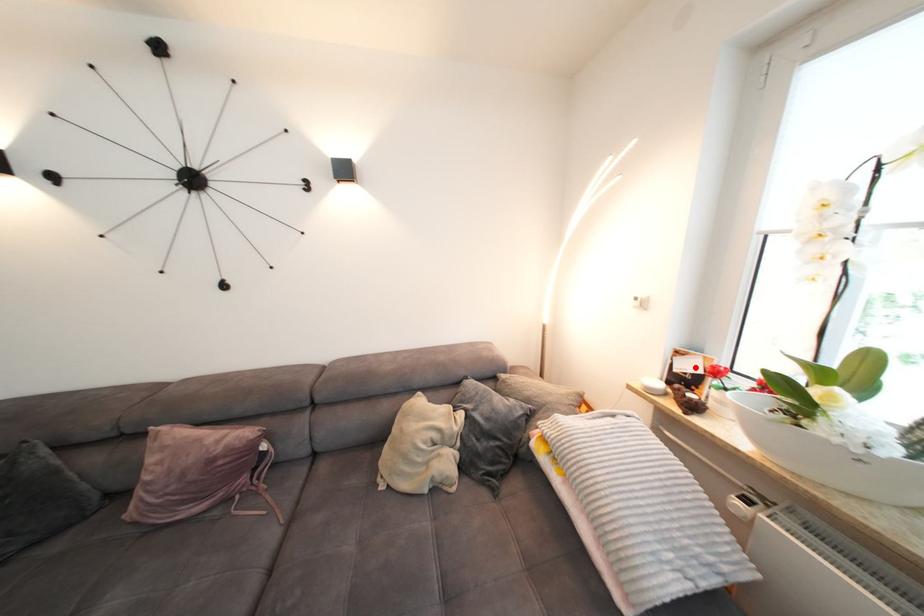
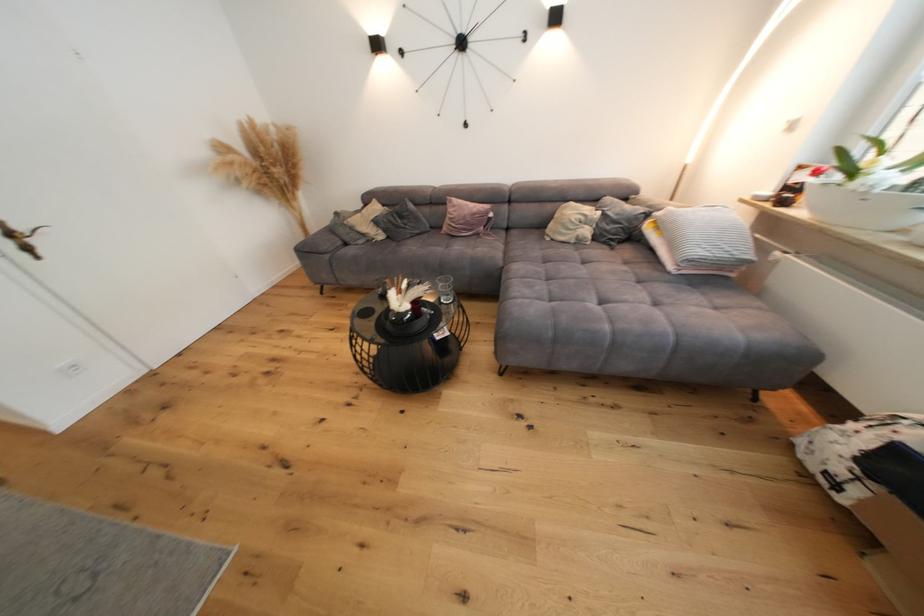
Where in the second image is the point corresponding to the highlighted location from the first image?

(809, 179)